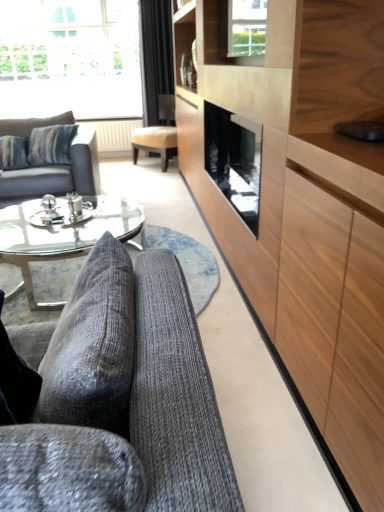
This screenshot has height=512, width=384. What do you see at coordinates (69, 58) in the screenshot? I see `transparent glass window at upper left, which appears as the first window when viewed from the top` at bounding box center [69, 58].

Measure the distance between transparent glass window at upper left, marked as the second window in a right-to-left arrangement, and camera.

transparent glass window at upper left, marked as the second window in a right-to-left arrangement, and camera are 5.39 meters apart.

Find the location of a particular element. The width and height of the screenshot is (384, 512). transparent glass coffee table at center is located at coordinates (63, 236).

Where is `wooden cabinet at right`? wooden cabinet at right is located at coordinates (305, 204).

The width and height of the screenshot is (384, 512). In order to click on textured gray fabric couch at lower left, which is the 2th studio couch in left-to-right order in this screenshot , I will do `click(120, 399)`.

Describe the element at coordinates (246, 27) in the screenshot. This screenshot has width=384, height=512. I see `clear glass window at upper center, which is counted as the 1th window, starting from the front` at that location.

Describe the element at coordinates (156, 56) in the screenshot. This screenshot has height=512, width=384. I see `black velvet curtain at upper center` at that location.

Locate an element on the screen. Image resolution: width=384 pixels, height=512 pixels. transparent glass window at upper left, which appears as the first window when viewed from the top is located at coordinates (69, 58).

What's the angular difference between black velvet curtain at upper center and transparent glass coffee table at center's facing directions?

The angular difference between black velvet curtain at upper center and transparent glass coffee table at center is 92.5 degrees.

From the image's perspective, is black velvet curtain at upper center above or below transparent glass coffee table at center?

black velvet curtain at upper center is above transparent glass coffee table at center.

Between black velvet curtain at upper center and transparent glass coffee table at center, which one has smaller size?

black velvet curtain at upper center.

In the image, there is a black velvet curtain at upper center. Where is `coffee table below it (from a real-world perspective)`? The height and width of the screenshot is (512, 384). coffee table below it (from a real-world perspective) is located at coordinates (63, 236).

Looking at this image, would you say textured gray fabric couch at lower left, which is the 1th studio couch from right to left, is outside transparent glass window at upper left, the second window positioned from the front?

Yes, textured gray fabric couch at lower left, which is the 1th studio couch from right to left, is not within transparent glass window at upper left, the second window positioned from the front.

Which of these two, textured gray fabric couch at lower left, which is the first studio couch in bottom-to-top order, or transparent glass window at upper left, the 1th window in the left-to-right sequence, is thinner?

With smaller width is transparent glass window at upper left, the 1th window in the left-to-right sequence.

Who is smaller, textured gray fabric couch at lower left, which is the 2th studio couch in left-to-right order, or transparent glass window at upper left, the second window positioned from the front?

With smaller size is textured gray fabric couch at lower left, which is the 2th studio couch in left-to-right order.

Is beige fabric chair at center positioned beyond the bounds of matte gray fabric couch at left, the second studio couch when ordered from front to back?

Yes, beige fabric chair at center is outside of matte gray fabric couch at left, the second studio couch when ordered from front to back.

Which studio couch is the 1st one when counting from the front of the beige fabric chair at center? Please provide its 2D coordinates.

[(59, 172)]

Who is taller, beige fabric chair at center or matte gray fabric couch at left, placed as the 2th studio couch when sorted from bottom to top?

beige fabric chair at center is taller.

From the image's perspective, is beige fabric chair at center located above matte gray fabric couch at left, which ranks as the second studio couch in right-to-left order?

Yes, from the image's perspective, beige fabric chair at center is above matte gray fabric couch at left, which ranks as the second studio couch in right-to-left order.

Is textured gray fabric couch at lower left, which is the first studio couch in bottom-to-top order, outside of matte gray fabric couch at left, the second studio couch when ordered from front to back?

textured gray fabric couch at lower left, which is the first studio couch in bottom-to-top order, is positioned outside matte gray fabric couch at left, the second studio couch when ordered from front to back.

Is textured gray fabric couch at lower left, positioned as the 2th studio couch in top-to-bottom order, taller or shorter than matte gray fabric couch at left, the 1th studio couch from the top?

textured gray fabric couch at lower left, positioned as the 2th studio couch in top-to-bottom order, is shorter than matte gray fabric couch at left, the 1th studio couch from the top.

This screenshot has height=512, width=384. In order to click on studio couch located behind the textured gray fabric couch at lower left, which is the 1th studio couch from right to left in this screenshot , I will do `click(59, 172)`.

From the image's perspective, relative to matte gray fabric couch at left, acting as the first studio couch starting from the back, is textured gray fabric couch at lower left, the 2th studio couch viewed from the back, above or below?

Clearly, from the image's perspective, textured gray fabric couch at lower left, the 2th studio couch viewed from the back, is below matte gray fabric couch at left, acting as the first studio couch starting from the back.

Does clear glass window at upper center, which is the first window from bottom to top, have a greater height compared to matte gray fabric couch at left, the 1th studio couch from the top?

In fact, clear glass window at upper center, which is the first window from bottom to top, may be shorter than matte gray fabric couch at left, the 1th studio couch from the top.

How much distance is there between clear glass window at upper center, placed as the 2th window when sorted from back to front, and matte gray fabric couch at left, the first studio couch when ordered from left to right?

They are 5.36 feet apart.

From a real-world perspective, which is physically above, clear glass window at upper center, which ranks as the 1th window in right-to-left order, or matte gray fabric couch at left, the first studio couch when ordered from left to right?

clear glass window at upper center, which ranks as the 1th window in right-to-left order, is physically above.

Which of these two, clear glass window at upper center, placed as the 2th window when sorted from left to right, or matte gray fabric couch at left, the first studio couch when ordered from left to right, is thinner?

clear glass window at upper center, placed as the 2th window when sorted from left to right.

Does point (34, 254) come closer to viewer compared to point (97, 20)?

Yes, point (34, 254) is closer to viewer.

From the image's perspective, which is below, transparent glass coffee table at center or transparent glass window at upper left, placed as the 2th window when sorted from bottom to top?

transparent glass coffee table at center is shown below in the image.

Can we say transparent glass coffee table at center lies outside transparent glass window at upper left, which appears as the 1th window when viewed from the back?

Indeed, transparent glass coffee table at center is completely outside transparent glass window at upper left, which appears as the 1th window when viewed from the back.

How much distance is there between matte gray fabric couch at left, the first studio couch when ordered from left to right, and beige fabric chair at center?

matte gray fabric couch at left, the first studio couch when ordered from left to right, and beige fabric chair at center are 1.50 meters apart.

In terms of size, does matte gray fabric couch at left, the second studio couch when ordered from front to back, appear bigger or smaller than beige fabric chair at center?

Clearly, matte gray fabric couch at left, the second studio couch when ordered from front to back, is larger in size than beige fabric chair at center.

Can we say matte gray fabric couch at left, the second studio couch when ordered from front to back, lies outside beige fabric chair at center?

Yes.

From a real-world perspective, which object rests below the other?

matte gray fabric couch at left, which ranks as the second studio couch in right-to-left order, is physically lower.

Find the location of a particular element. coffee table that appears in front of the black velvet curtain at upper center is located at coordinates (63, 236).

Where is `the 2nd window above when counting from the textured gray fabric couch at lower left, marked as the first studio couch in a front-to-back arrangement (from the image's perspective)`? This screenshot has height=512, width=384. the 2nd window above when counting from the textured gray fabric couch at lower left, marked as the first studio couch in a front-to-back arrangement (from the image's perspective) is located at coordinates (69, 58).

Estimate the real-world distances between objects in this image. Which object is further from transparent glass window at upper left, placed as the 2th window when sorted from bottom to top, transparent glass coffee table at center or matte gray fabric couch at left, the first studio couch when ordered from left to right?

transparent glass coffee table at center lies further to transparent glass window at upper left, placed as the 2th window when sorted from bottom to top, than the other object.

Looking at the image, which one is located closer to clear glass window at upper center, which ranks as the 1th window in right-to-left order, transparent glass coffee table at center or transparent glass window at upper left, which appears as the 1th window when viewed from the back?

transparent glass coffee table at center is closer to clear glass window at upper center, which ranks as the 1th window in right-to-left order.

Based on their spatial positions, is matte gray fabric couch at left, the 1th studio couch from the top, or beige fabric chair at center further from black velvet curtain at upper center?

matte gray fabric couch at left, the 1th studio couch from the top, is positioned further to the anchor black velvet curtain at upper center.

Considering their positions, is black velvet curtain at upper center positioned closer to transparent glass coffee table at center than matte gray fabric couch at left, placed as the 2th studio couch when sorted from bottom to top?

The object closer to transparent glass coffee table at center is matte gray fabric couch at left, placed as the 2th studio couch when sorted from bottom to top.

When comparing their distances from transparent glass window at upper left, the second window positioned from the front, does wooden cabinet at right or clear glass window at upper center, placed as the 2th window when sorted from back to front, seem closer?

The object closer to transparent glass window at upper left, the second window positioned from the front, is clear glass window at upper center, placed as the 2th window when sorted from back to front.

Looking at the image, which one is located closer to matte gray fabric couch at left, which ranks as the second studio couch in right-to-left order, transparent glass window at upper left, which appears as the 1th window when viewed from the back, or beige fabric chair at center?

The object closer to matte gray fabric couch at left, which ranks as the second studio couch in right-to-left order, is beige fabric chair at center.

Based on the photo, when comparing their distances from wooden cabinet at right, does transparent glass coffee table at center or textured gray fabric couch at lower left, which is the 2th studio couch in left-to-right order, seem closer?

textured gray fabric couch at lower left, which is the 2th studio couch in left-to-right order.

Looking at the image, which one is located further to clear glass window at upper center, which is the first window from bottom to top, matte gray fabric couch at left, the first studio couch when ordered from left to right, or black velvet curtain at upper center?

black velvet curtain at upper center lies further to clear glass window at upper center, which is the first window from bottom to top, than the other object.

Locate an element on the screen. This screenshot has width=384, height=512. studio couch located between textured gray fabric couch at lower left, the 2th studio couch viewed from the back, and black velvet curtain at upper center in the depth direction is located at coordinates (59, 172).

Locate an element on the screen. chair positioned between clear glass window at upper center, the second window from the top, and transparent glass window at upper left, the 1th window in the left-to-right sequence, from near to far is located at coordinates (158, 134).

At what (x,y) coordinates should I click in order to perform the action: click on coffee table located between matte gray fabric couch at left, the second studio couch when ordered from front to back, and clear glass window at upper center, which is the first window from bottom to top, in the left-right direction. Please return your answer as a coordinate pair (x, y). The image size is (384, 512). Looking at the image, I should click on (63, 236).

Locate an element on the screen. window located between textured gray fabric couch at lower left, which is the 2th studio couch in left-to-right order, and beige fabric chair at center in the depth direction is located at coordinates (246, 27).